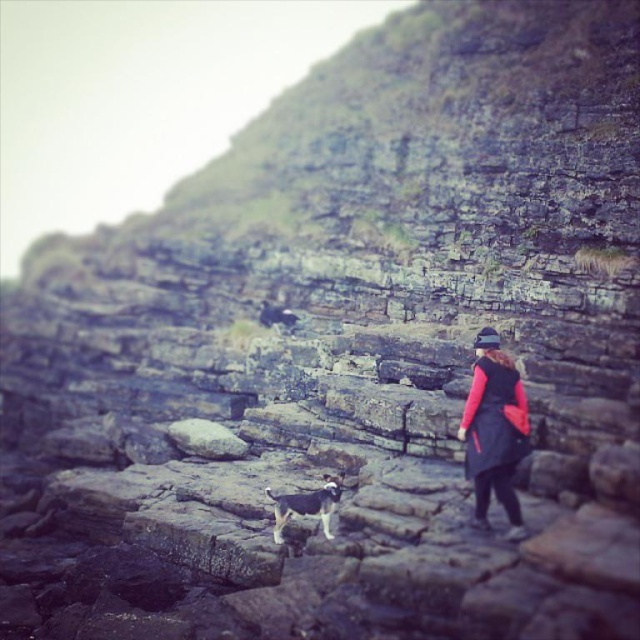
Based on the photo, does dark red fabric jacket at right appear over brown and white fur dog at center?

Correct, dark red fabric jacket at right is located above brown and white fur dog at center.

Who is lower down, dark red fabric jacket at right or brown and white fur dog at center?

brown and white fur dog at center

Measure the distance between point (484, 360) and camera.

Point (484, 360) is 13.55 meters away from camera.

Locate an element on the screen. This screenshot has height=640, width=640. dark red fabric jacket at right is located at coordinates (493, 429).